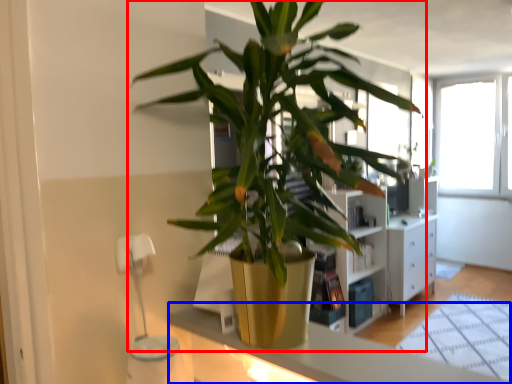
Question: Which object appears closest to the camera in this image, houseplant (highlighted by a red box) or counter top (highlighted by a blue box)?

Choices:
 (A) houseplant
 (B) counter top

Answer: (A)